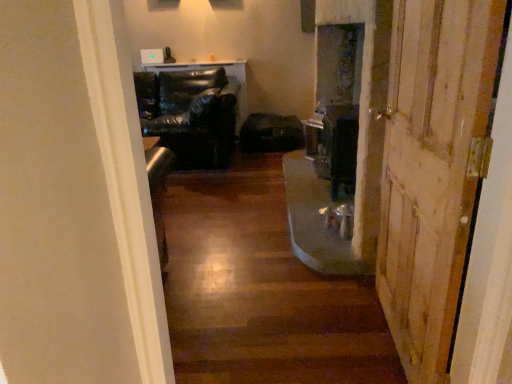
The width and height of the screenshot is (512, 384). Find the location of `free space to the left of wooden door at right`. free space to the left of wooden door at right is located at coordinates (297, 335).